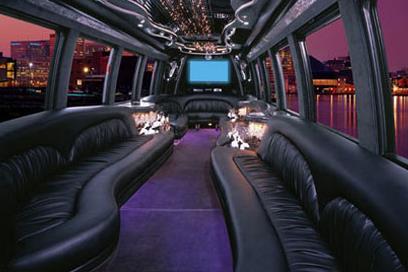
Identify the location of cushion. click(302, 197).